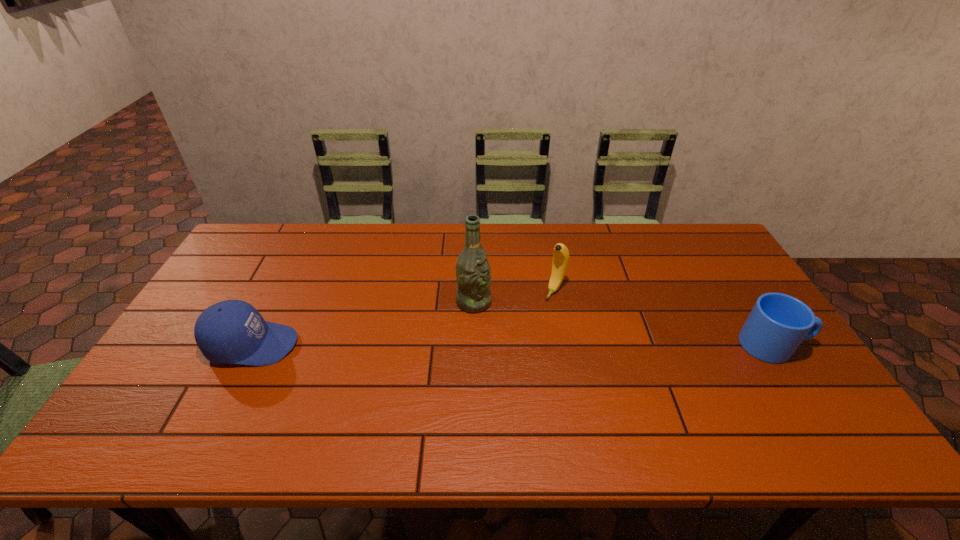
Where is `free spot between the third object from left to right and the leftmost object`? Image resolution: width=960 pixels, height=540 pixels. free spot between the third object from left to right and the leftmost object is located at coordinates (404, 318).

Locate an element on the screen. free space between the cap and the second object from left to right is located at coordinates (363, 323).

Identify the location of free point between the leftmost object and the rightmost object. The width and height of the screenshot is (960, 540). (514, 345).

At what (x,y) coordinates should I click in order to perform the action: click on free space between the rightmost object and the beer bottle. Please return your answer as a coordinate pair (x, y). This screenshot has height=540, width=960. Looking at the image, I should click on (624, 323).

Identify the location of free space between the leftmost object and the second object from left to right. This screenshot has width=960, height=540. click(363, 323).

Locate an element on the screen. The image size is (960, 540). empty space that is in between the leftmost object and the rightmost object is located at coordinates 514,345.

Where is `vacant region between the leftmost object and the beer bottle`? This screenshot has height=540, width=960. vacant region between the leftmost object and the beer bottle is located at coordinates (363, 323).

Image resolution: width=960 pixels, height=540 pixels. Identify the location of vacant space that's between the leftmost object and the mug. click(x=514, y=345).

The height and width of the screenshot is (540, 960). Identify the location of free space between the rightmost object and the leftmost object. (514, 345).

Locate an element on the screen. Image resolution: width=960 pixels, height=540 pixels. vacant area between the rightmost object and the second object from left to right is located at coordinates (624, 323).